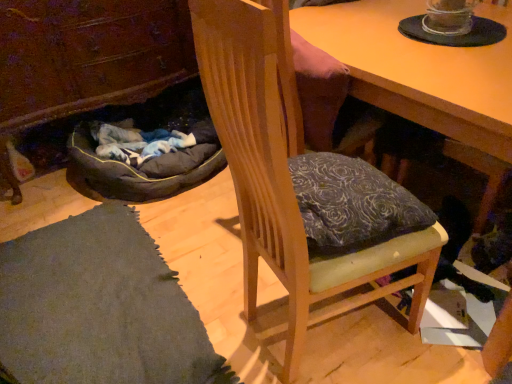
Question: Would you say wooden desk at center is inside or outside wooden cabinet at lower left?

Choices:
 (A) outside
 (B) inside

Answer: (A)

Question: In the image, is wooden desk at center on the left side or the right side of wooden cabinet at lower left?

Choices:
 (A) right
 (B) left

Answer: (A)

Question: Estimate the real-world distances between objects in this image. Which object is farther from the wooden cabinet at lower left?

Choices:
 (A) wooden desk at center
 (B) wooden chair at center

Answer: (B)

Question: Considering the real-world distances, which object is farthest from the wooden desk at center?

Choices:
 (A) wooden cabinet at lower left
 (B) wooden chair at center

Answer: (A)